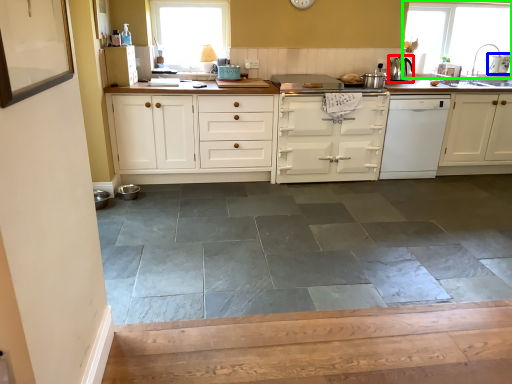
Question: Which is farther away from kitchen appliance (highlighted by a red box)? appliance (highlighted by a blue box) or window (highlighted by a green box)?

Choices:
 (A) appliance
 (B) window

Answer: (A)